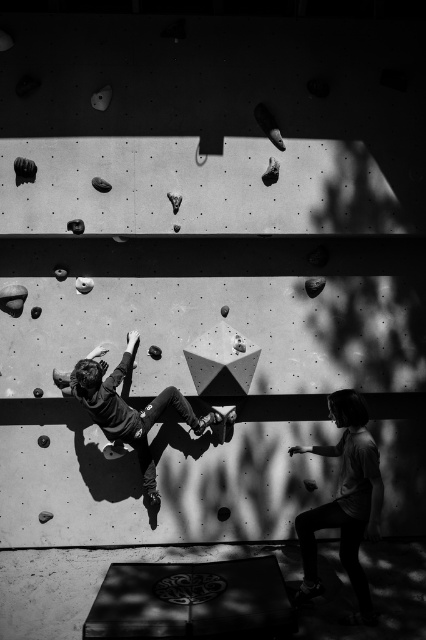
Question: Is light gray cotton shirt at lower right to the left of smooth gray climbing hold at center from the viewer's perspective?

Choices:
 (A) yes
 (B) no

Answer: (B)

Question: Which of the following is the farthest from the observer?

Choices:
 (A) light gray cotton shirt at lower right
 (B) smooth gray climbing hold at center

Answer: (B)

Question: Does light gray cotton shirt at lower right appear on the right side of smooth gray climbing hold at center?

Choices:
 (A) yes
 (B) no

Answer: (A)

Question: Does light gray cotton shirt at lower right come in front of smooth gray climbing hold at center?

Choices:
 (A) no
 (B) yes

Answer: (B)